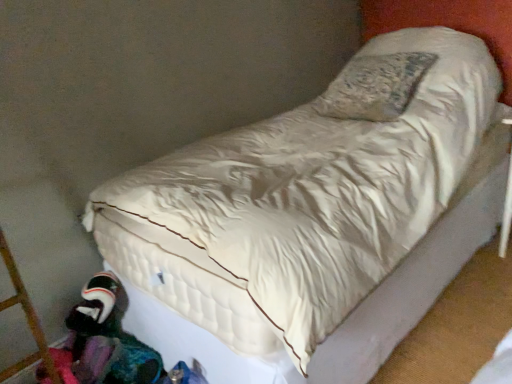
I want to click on plush fabric toy at lower left, so click(x=94, y=312).

The height and width of the screenshot is (384, 512). What do you see at coordinates (94, 312) in the screenshot?
I see `plush fabric toy at lower left` at bounding box center [94, 312].

At what (x,y) coordinates should I click in order to perform the action: click on multicolored fabric at lower left. Please return your answer as a coordinate pair (x, y). Looking at the image, I should click on (106, 361).

What do you see at coordinates (106, 361) in the screenshot?
I see `multicolored fabric at lower left` at bounding box center [106, 361].

Locate an element on the screen. Image resolution: width=512 pixels, height=384 pixels. plush fabric toy at lower left is located at coordinates (94, 312).

Can you confirm if multicolored fabric at lower left is positioned to the right of plush fabric toy at lower left?

Correct, you'll find multicolored fabric at lower left to the right of plush fabric toy at lower left.

Between multicolored fabric at lower left and plush fabric toy at lower left, which one is positioned in front?

multicolored fabric at lower left is closer to the camera.

Considering the points (78, 369) and (90, 310), which point is in front, point (78, 369) or point (90, 310)?

The point (78, 369) is more forward.

From the image's perspective, is multicolored fabric at lower left located above or below plush fabric toy at lower left?

From the image's perspective, multicolored fabric at lower left appears below plush fabric toy at lower left.

From a real-world perspective, is multicolored fabric at lower left positioned above or below plush fabric toy at lower left?

multicolored fabric at lower left is situated lower than plush fabric toy at lower left in the real world.

Which of these two, multicolored fabric at lower left or plush fabric toy at lower left, is wider?

Wider between the two is multicolored fabric at lower left.

Between multicolored fabric at lower left and plush fabric toy at lower left, which one has more height?

Standing taller between the two is plush fabric toy at lower left.

Can you confirm if multicolored fabric at lower left is smaller than plush fabric toy at lower left?

Incorrect, multicolored fabric at lower left is not smaller in size than plush fabric toy at lower left.

Is plush fabric toy at lower left inside multicolored fabric at lower left?

No, plush fabric toy at lower left is not surrounded by multicolored fabric at lower left.

Is the surface of multicolored fabric at lower left in direct contact with plush fabric toy at lower left?

multicolored fabric at lower left and plush fabric toy at lower left are clearly separated.

Is multicolored fabric at lower left oriented towards plush fabric toy at lower left?

No, multicolored fabric at lower left is not aimed at plush fabric toy at lower left.

What's the angular difference between multicolored fabric at lower left and plush fabric toy at lower left's facing directions?

The facing directions of multicolored fabric at lower left and plush fabric toy at lower left are 0.00129 degrees apart.

Locate an element on the screen. This screenshot has width=512, height=384. toy lying above the multicolored fabric at lower left (from the image's perspective) is located at coordinates (94, 312).

Can you confirm if plush fabric toy at lower left is positioned to the left of multicolored fabric at lower left?

Yes, plush fabric toy at lower left is to the left of multicolored fabric at lower left.

Considering the positions of objects plush fabric toy at lower left and multicolored fabric at lower left in the image provided, who is in front, plush fabric toy at lower left or multicolored fabric at lower left?

Positioned in front is multicolored fabric at lower left.

Is point (105, 307) positioned behind point (132, 337)?

No.

From the image's perspective, who appears lower, plush fabric toy at lower left or multicolored fabric at lower left?

From the image's view, multicolored fabric at lower left is below.

From a real-world perspective, is plush fabric toy at lower left on top of multicolored fabric at lower left?

Yes, from a real-world perspective, plush fabric toy at lower left is on top of multicolored fabric at lower left.

Between plush fabric toy at lower left and multicolored fabric at lower left, which one has smaller width?

With smaller width is plush fabric toy at lower left.

Considering the sizes of objects plush fabric toy at lower left and multicolored fabric at lower left in the image provided, who is shorter, plush fabric toy at lower left or multicolored fabric at lower left?

Standing shorter between the two is multicolored fabric at lower left.

Which of these two, plush fabric toy at lower left or multicolored fabric at lower left, is bigger?

multicolored fabric at lower left.

Which is correct: plush fabric toy at lower left is inside multicolored fabric at lower left, or outside of it?

plush fabric toy at lower left is located beyond the bounds of multicolored fabric at lower left.

Does plush fabric toy at lower left touch multicolored fabric at lower left?

No, plush fabric toy at lower left is not beside multicolored fabric at lower left.

Is plush fabric toy at lower left oriented away from multicolored fabric at lower left?

That's not correct — plush fabric toy at lower left is not looking away from multicolored fabric at lower left.

Find the location of a particular element. toy above the multicolored fabric at lower left (from a real-world perspective) is located at coordinates (94, 312).

Image resolution: width=512 pixels, height=384 pixels. I want to click on toy located above the multicolored fabric at lower left (from a real-world perspective), so click(x=94, y=312).

At what (x,y) coordinates should I click in order to perform the action: click on clothing lying in front of the plush fabric toy at lower left. Please return your answer as a coordinate pair (x, y). Looking at the image, I should click on (106, 361).